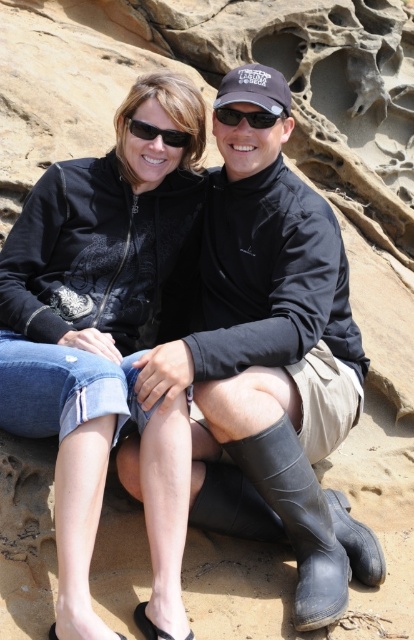
Between black matte sunglasses at upper center and black plastic sunglasses at upper center, which one appears on the right side from the viewer's perspective?

From the viewer's perspective, black plastic sunglasses at upper center appears more on the right side.

Can you confirm if black matte sunglasses at upper center is smaller than black plastic sunglasses at upper center?

Actually, black matte sunglasses at upper center might be larger than black plastic sunglasses at upper center.

Where is `black matte sunglasses at upper center`? This screenshot has width=414, height=640. black matte sunglasses at upper center is located at coordinates (158, 132).

Where is `black matte sunglasses at upper center`? This screenshot has width=414, height=640. black matte sunglasses at upper center is located at coordinates (158, 132).

What do you see at coordinates (298, 518) in the screenshot? I see `black rubber boot at lower center` at bounding box center [298, 518].

Which is behind, point (319, 616) or point (231, 124)?

The point (231, 124) is behind.

Where is `black rubber boot at lower center`? This screenshot has width=414, height=640. black rubber boot at lower center is located at coordinates (298, 518).

Does black rubber boot at lower center appear under black matte sunglasses at upper center?

Correct, black rubber boot at lower center is located below black matte sunglasses at upper center.

Is black rubber boot at lower center closer to the viewer compared to black matte sunglasses at upper center?

Yes, black rubber boot at lower center is closer to the viewer.

Is point (277, 506) farther from camera compared to point (165, 138)?

No, it is not.

Locate an element on the screen. black rubber boot at lower center is located at coordinates (298, 518).